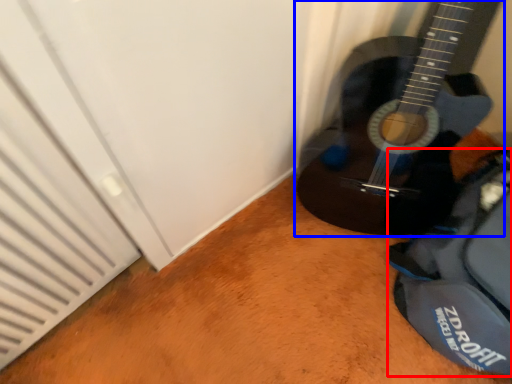
Question: Which of the following is the farthest to the observer, messenger bag (highlighted by a red box) or guitar (highlighted by a blue box)?

Choices:
 (A) messenger bag
 (B) guitar

Answer: (A)